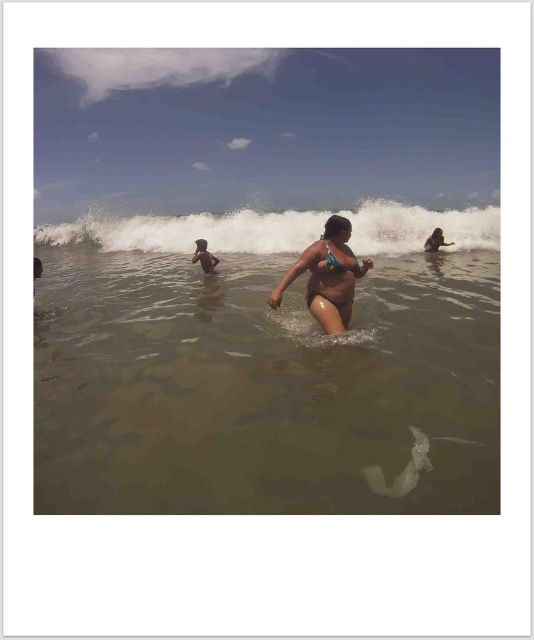
Question: Which object appears farthest from the camera in this image?

Choices:
 (A) white foam wave at upper center
 (B) smooth skin girl at upper right

Answer: (B)

Question: Does brown matte water at center appear under white foam wave at upper center?

Choices:
 (A) yes
 (B) no

Answer: (A)

Question: Which point is farther from the camera taking this photo?

Choices:
 (A) (223, 214)
 (B) (282, 288)
 (C) (348, 310)
 (D) (478, 305)

Answer: (A)

Question: Among these points, which one is farthest from the camera?

Choices:
 (A) (443, 240)
 (B) (90, 460)
 (C) (315, 253)

Answer: (A)

Question: Does white foam wave at upper center have a larger size compared to blue bikini at center?

Choices:
 (A) no
 (B) yes

Answer: (B)

Question: Is white foam wave at upper center above blue bikini at center?

Choices:
 (A) yes
 (B) no

Answer: (A)